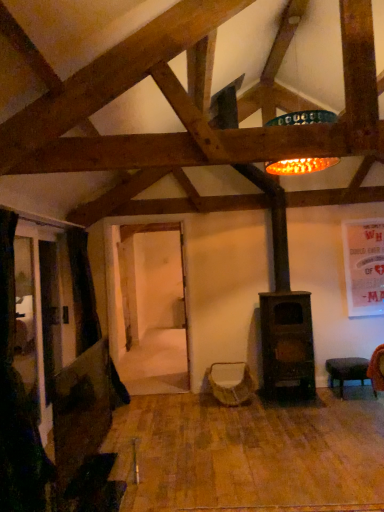
Question: Considering the relative sizes of black fabric curtain at left and black leather stool at lower right in the image provided, is black fabric curtain at left thinner than black leather stool at lower right?

Choices:
 (A) yes
 (B) no

Answer: (A)

Question: Does black fabric curtain at left have a greater width compared to black leather stool at lower right?

Choices:
 (A) no
 (B) yes

Answer: (A)

Question: Does black fabric curtain at left have a lesser height compared to black leather stool at lower right?

Choices:
 (A) no
 (B) yes

Answer: (A)

Question: Does black fabric curtain at left come in front of black leather stool at lower right?

Choices:
 (A) no
 (B) yes

Answer: (B)

Question: Is black fabric curtain at left facing away from black leather stool at lower right?

Choices:
 (A) no
 (B) yes

Answer: (A)

Question: Is black fabric curtain at left at the right side of black leather stool at lower right?

Choices:
 (A) no
 (B) yes

Answer: (A)

Question: From the image's perspective, is black fabric curtain at left located above woven fabric swivel chair at center?

Choices:
 (A) no
 (B) yes

Answer: (B)

Question: Is black fabric curtain at left outside of woven fabric swivel chair at center?

Choices:
 (A) yes
 (B) no

Answer: (A)

Question: From a real-world perspective, does black fabric curtain at left sit lower than woven fabric swivel chair at center?

Choices:
 (A) no
 (B) yes

Answer: (A)

Question: Is black fabric curtain at left with woven fabric swivel chair at center?

Choices:
 (A) no
 (B) yes

Answer: (A)

Question: Can you confirm if black fabric curtain at left is positioned to the right of woven fabric swivel chair at center?

Choices:
 (A) no
 (B) yes

Answer: (A)

Question: Is the position of black fabric curtain at left less distant than that of woven fabric swivel chair at center?

Choices:
 (A) no
 (B) yes

Answer: (B)

Question: Is woven fabric swivel chair at center to the left of black fabric curtain at left from the viewer's perspective?

Choices:
 (A) no
 (B) yes

Answer: (A)